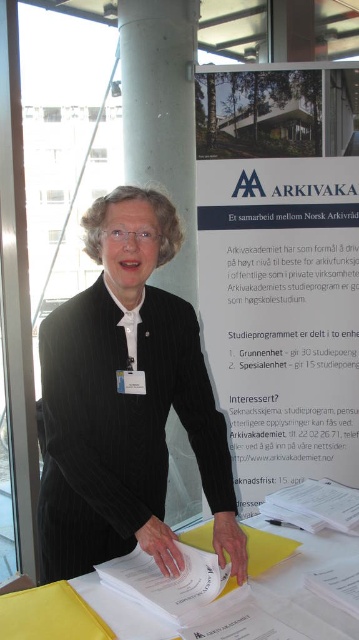
Question: Which object is closer to the camera taking this photo?

Choices:
 (A) black woolen sweater at center
 (B) blue paper at upper center

Answer: (A)

Question: Does black woolen sweater at center have a lesser width compared to white smooth pillar at center?

Choices:
 (A) no
 (B) yes

Answer: (A)

Question: Among these points, which one is nearest to the camera?

Choices:
 (A) (238, 445)
 (B) (138, 1)

Answer: (A)

Question: Does black woolen sweater at center have a greater width compared to white smooth pillar at center?

Choices:
 (A) yes
 (B) no

Answer: (A)

Question: Among these objects, which one is nearest to the camera?

Choices:
 (A) blue paper at upper center
 (B) black woolen sweater at center
 (C) white smooth pillar at center

Answer: (B)

Question: Can you confirm if blue paper at upper center is wider than white smooth pillar at center?

Choices:
 (A) no
 (B) yes

Answer: (B)